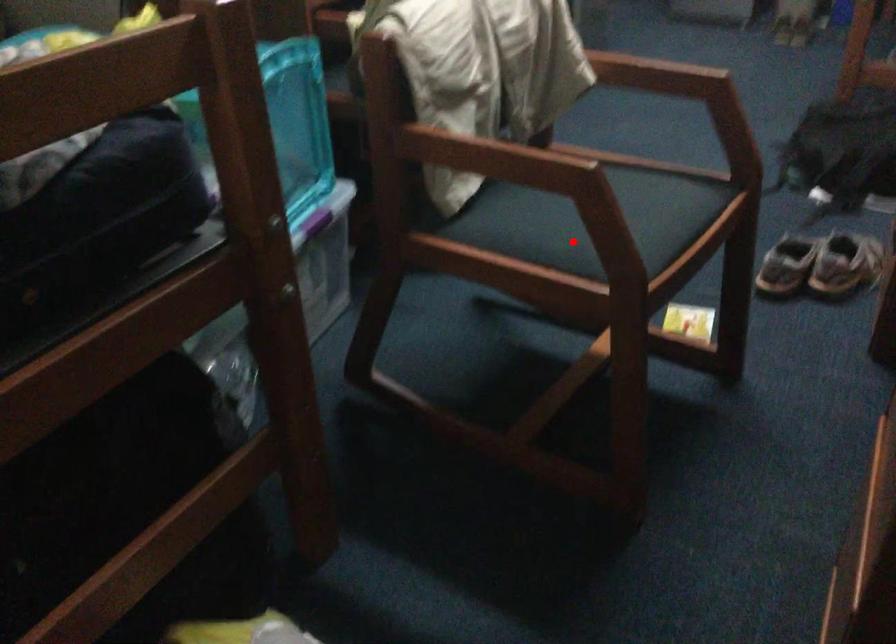
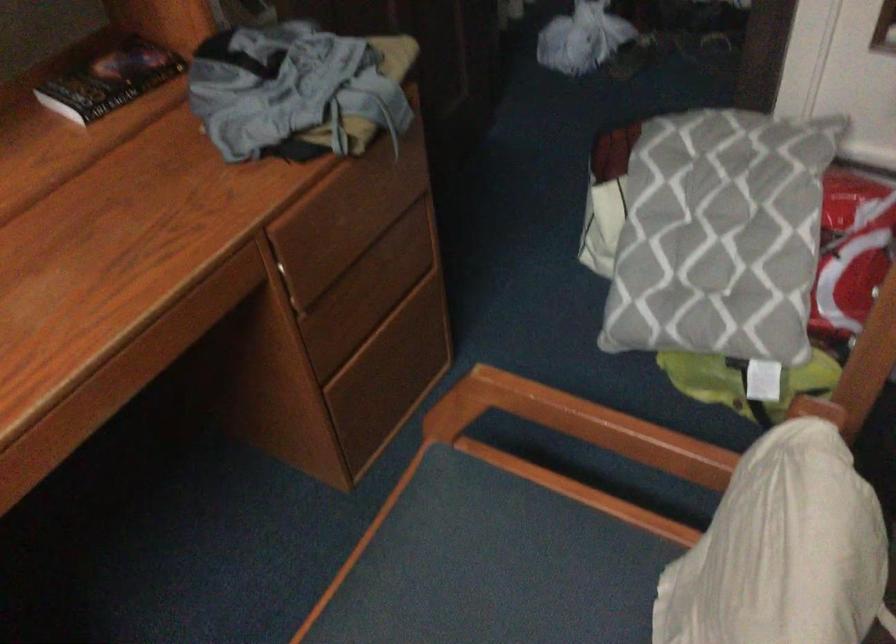
In the second image, find the point that corresponds to the highlighted location in the first image.

(549, 580)